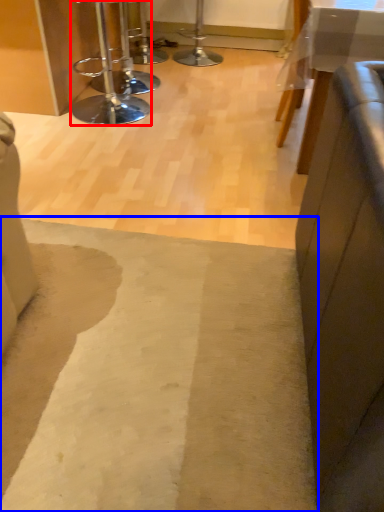
Question: Which of the following is the closest to the observer, stool (highlighted by a red box) or mat (highlighted by a blue box)?

Choices:
 (A) stool
 (B) mat

Answer: (B)